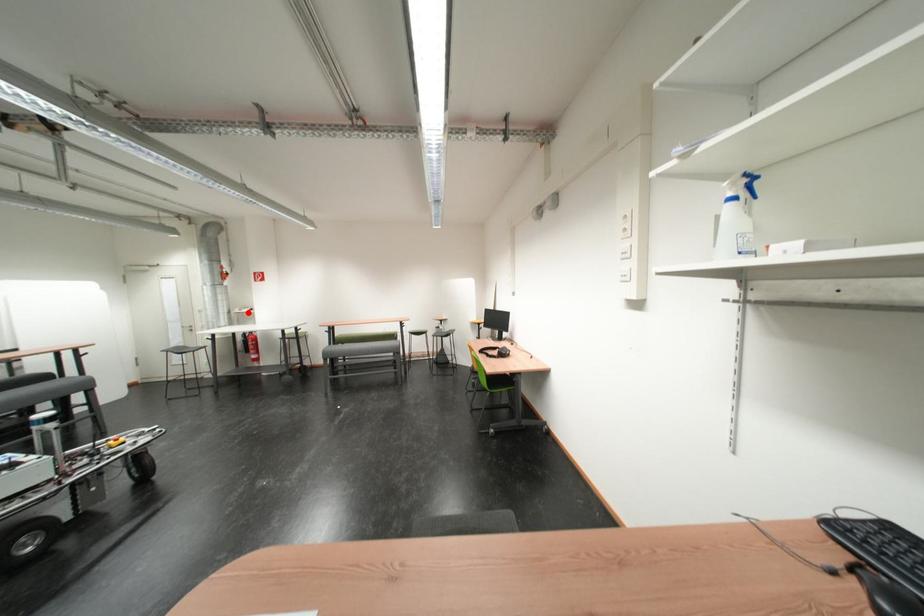
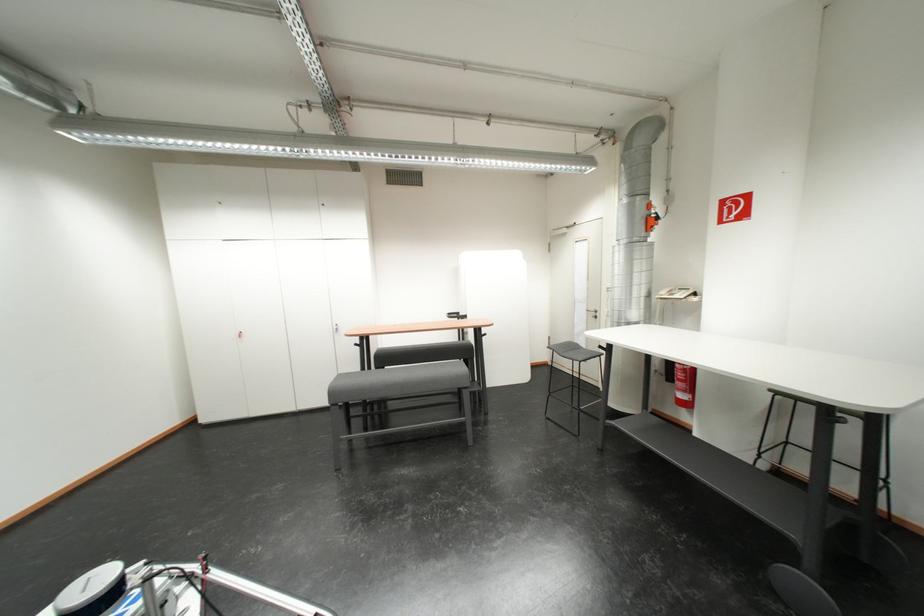
Where in the second image is the point corresponding to the highlighted location from the first image?

(675, 296)